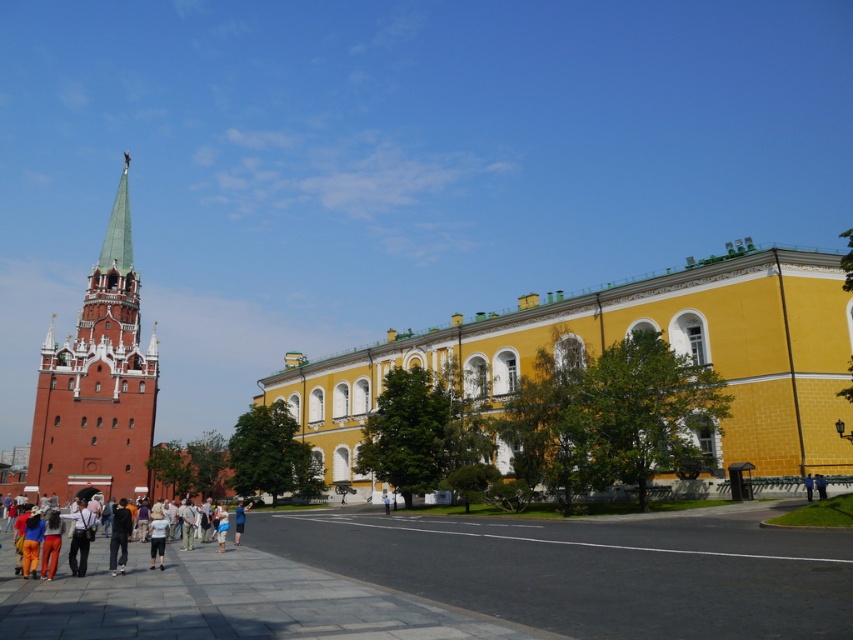
Question: Based on their relative distances, which object is farther from the brick tower at left?

Choices:
 (A) blue denim jeans at center
 (B) yellow matte building at center
 (C) blue fabric jacket at center
 (D) blue fabric person at center

Answer: (C)

Question: Which point appears closest to the camera in this image?

Choices:
 (A) (140, 556)
 (B) (389, 605)
 (C) (819, 486)

Answer: (B)

Question: Which point is farther to the camera?

Choices:
 (A) blue denim jeans at center
 (B) blue fabric jacket at center
 (C) multicolored clothing at center
 (D) gray concrete plaza at lower left

Answer: (A)

Question: Can you confirm if gray concrete plaza at lower left is positioned to the right of yellow matte building at center?

Choices:
 (A) no
 (B) yes

Answer: (A)

Question: Is multicolored clothing at center bigger than blue denim jeans at center?

Choices:
 (A) yes
 (B) no

Answer: (B)

Question: Can you confirm if multicolored clothing at center is thinner than blue fabric person at center?

Choices:
 (A) yes
 (B) no

Answer: (B)